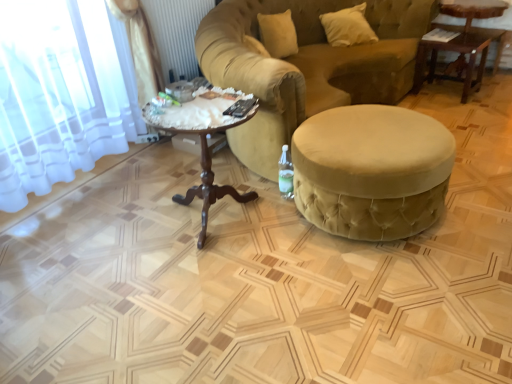
I want to click on free space in front of mahogany wood coffee table at center, so click(211, 285).